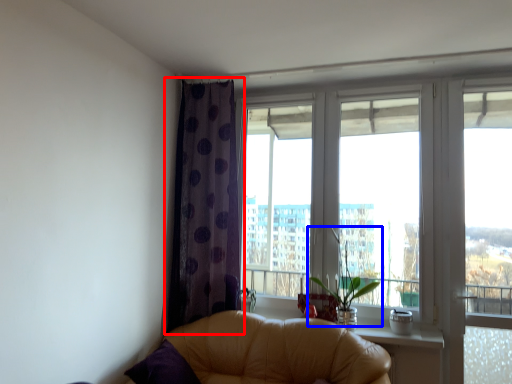
Question: Which object appears farthest to the camera in this image, curtain (highlighted by a red box) or plant (highlighted by a blue box)?

Choices:
 (A) curtain
 (B) plant

Answer: (A)